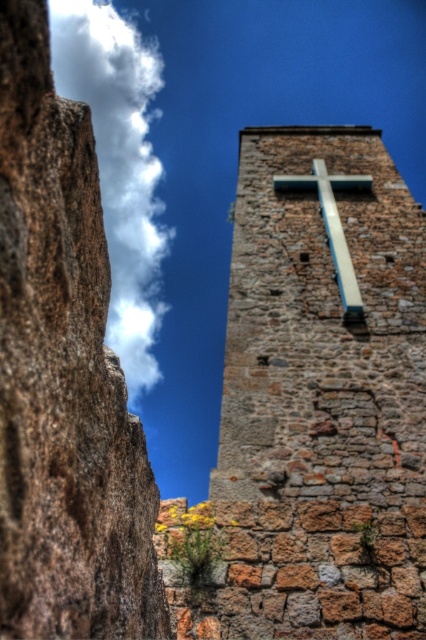
You are a photographer aiming to capture the metallic silver cross at center in your shot. However, there is a white fluffy cloud at upper left that might obstruct it. Based on their sizes, will the cloud block the cross?

The white fluffy cloud at upper left is much taller than the metallic silver cross at center, so it might block the cross depending on their positions.

You are standing in front of the tower and want to place a new decorative cross between the rustic stone cross at upper center and the metallic silver cross at center. Is there enough vertical space between them to fit a cross that is 1 meter tall?

The rustic stone cross at upper center is located above the metallic silver cross at center, but the exact distance between them is not provided. Without knowing the vertical space available, it is impossible to determine if the 1 meter tall cross will fit between them.